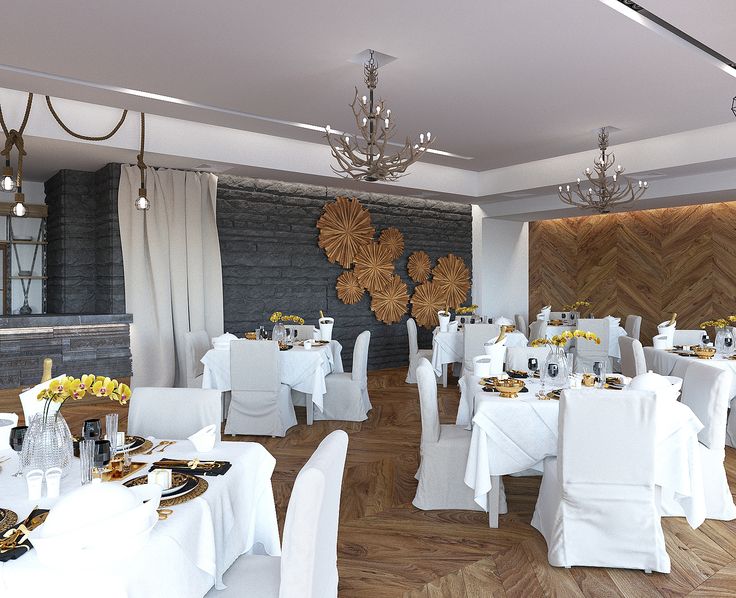
The width and height of the screenshot is (736, 598). Find the location of `table`. table is located at coordinates (506, 430), (229, 503), (307, 368), (453, 341), (718, 392), (620, 329).